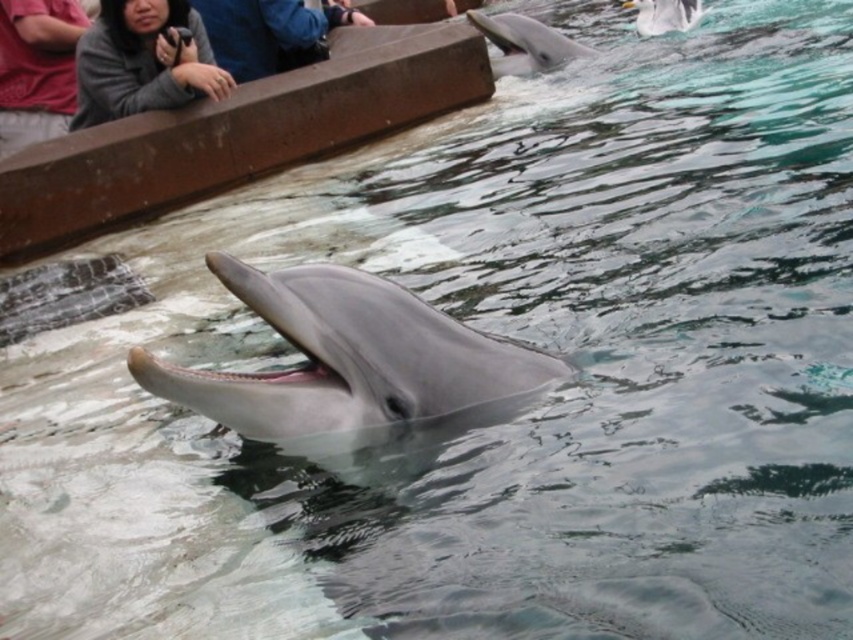
Who is more forward, [207,40] or [666,1]?

Point [207,40]

Does point (271, 70) lie behind point (677, 6)?

No, it is in front of (677, 6).

Where is `blue fabric at upper left`? This screenshot has width=853, height=640. blue fabric at upper left is located at coordinates (270, 33).

Who is positioned more to the left, gray sweater at upper left or sleek gray dolphin at upper center?

gray sweater at upper left is more to the left.

In the scene shown: Does gray sweater at upper left appear under sleek gray dolphin at upper center?

Yes.

Does point (158, 29) come in front of point (495, 60)?

Yes, point (158, 29) is closer to viewer.

The width and height of the screenshot is (853, 640). Find the location of `gray sweater at upper left`. gray sweater at upper left is located at coordinates (142, 61).

Is sleek gray dolphin at center below matte gray shirt at upper left?

Yes.

Is point (457, 328) in front of point (24, 141)?

That is True.

The height and width of the screenshot is (640, 853). I want to click on sleek gray dolphin at center, so click(352, 364).